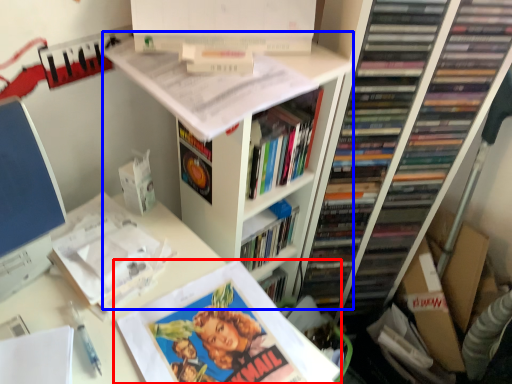
Question: Which point is closer to the camera, book (highlighted by a red box) or bookshelf (highlighted by a blue box)?

Choices:
 (A) book
 (B) bookshelf

Answer: (A)